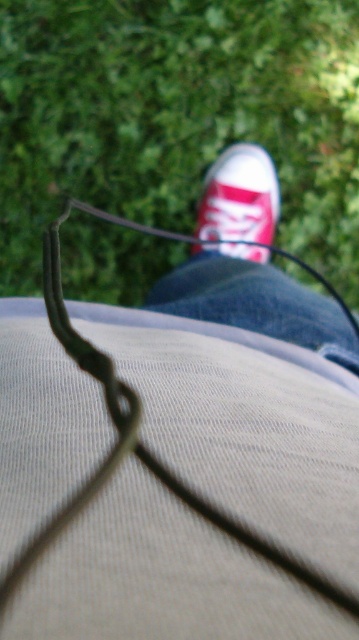
Which is behind, point (109, 74) or point (235, 216)?

Positioned behind is point (109, 74).

Between green grass at upper center and matte canvas shoe at center, which one is positioned higher?

green grass at upper center is above.

Locate an element on the screen. The image size is (359, 640). green grass at upper center is located at coordinates (178, 116).